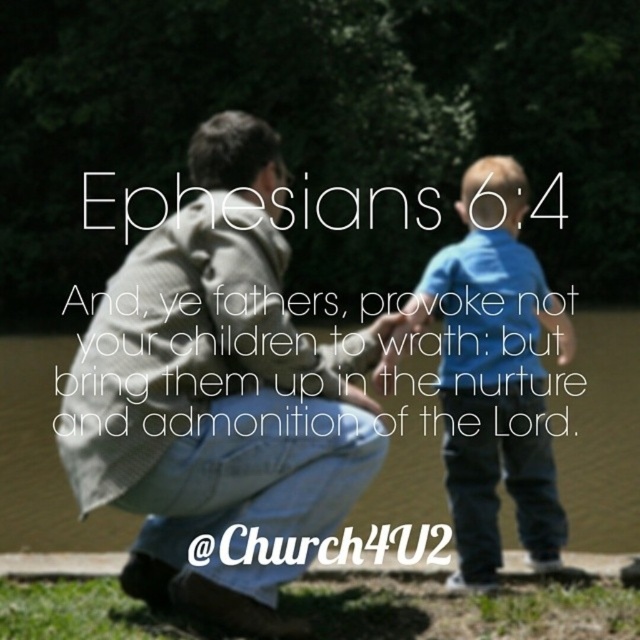
You are standing at the center of the park and see the light blue denim jeans at center and the clear water at lower left. Which object is closer to your right side?

Answer: The clear water at lower left is closer to your right side because the light blue denim jeans at center is positioned on the left side of it.

You are a photographer trying to capture the light blue denim jeans at center in the scene. Based on the coordinates provided, where should you position your camera to ensure the jeans are centered in your shot?

To center the light blue denim jeans at center in your shot, position your camera so that it is aimed at the coordinates point [218,396], as this is the 2D location of the light blue denim jeans at center.

You are standing in the park and see the clear water at lower left and the blue cotton shirt at center. Which object is positioned to the right of the other?

The clear water at lower left is positioned to the right of the blue cotton shirt at center.